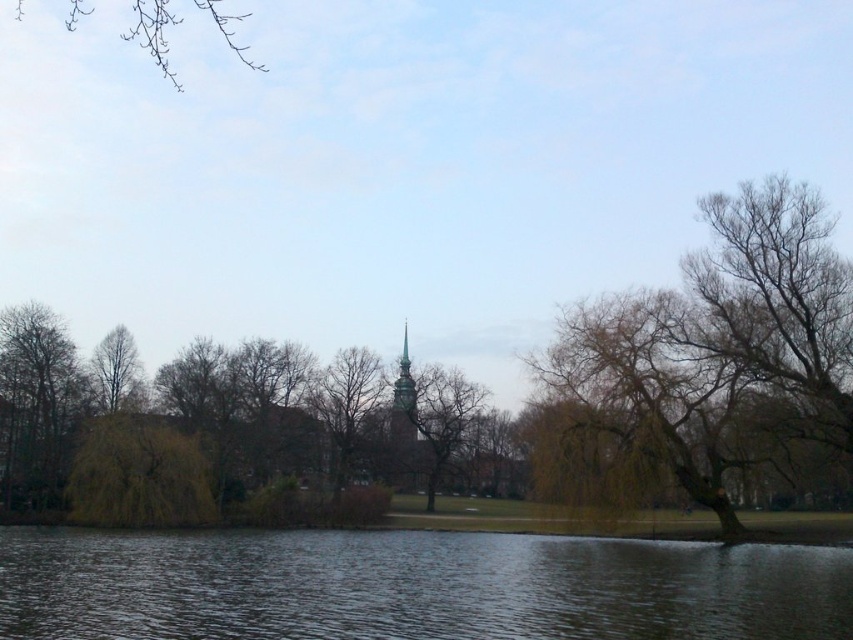
Question: Which point is farther to the camera?

Choices:
 (A) bare branches at upper left
 (B) dark water at lower center
 (C) bare wood tree at center
 (D) bare branches tree at right

Answer: (A)

Question: Which of the following is the farthest from the observer?

Choices:
 (A) (329, 422)
 (B) (242, 13)
 (C) (692, 563)
 (D) (726, 301)

Answer: (B)

Question: Does dark water at lower center have a greater width compared to bare wood tree at center?

Choices:
 (A) yes
 (B) no

Answer: (A)

Question: Can you confirm if green matte tree at left is smaller than bare wood tree at center?

Choices:
 (A) no
 (B) yes

Answer: (A)

Question: Which point is farther to the camera?

Choices:
 (A) (442, 460)
 (B) (166, 61)

Answer: (B)

Question: Is bare branches at upper left positioned behind bare wood tree at left?

Choices:
 (A) no
 (B) yes

Answer: (B)